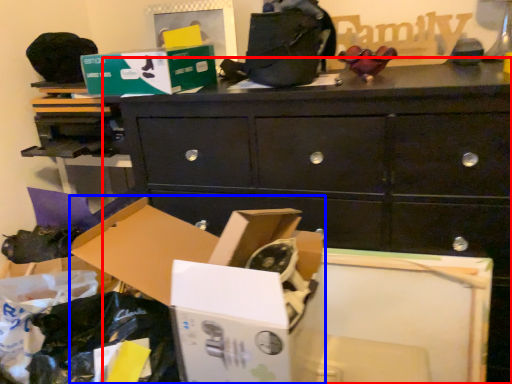
Question: Which object is further to the camera taking this photo, chest of drawers (highlighted by a red box) or storage box (highlighted by a blue box)?

Choices:
 (A) chest of drawers
 (B) storage box

Answer: (A)